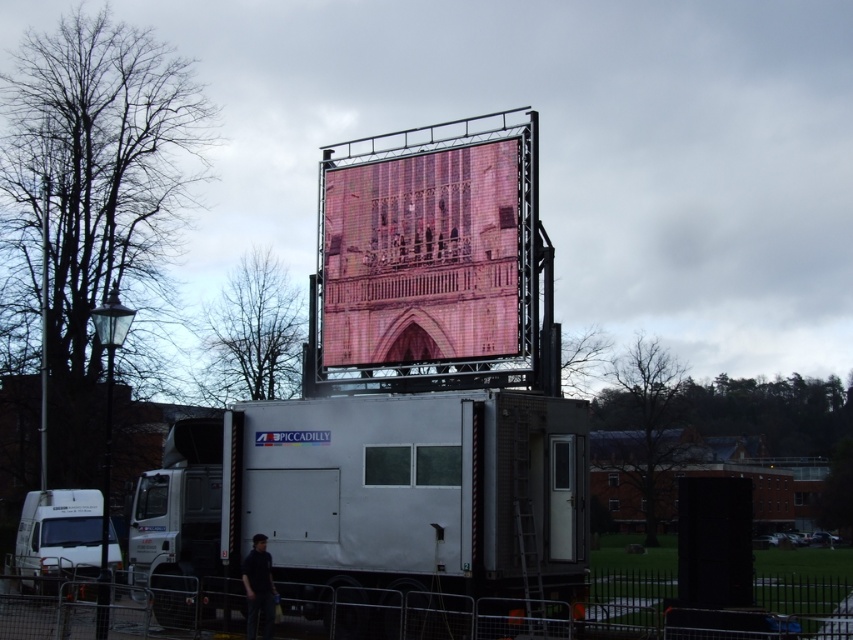
What do you see at coordinates (375, 497) in the screenshot? This screenshot has height=640, width=853. I see `white matte truck at center` at bounding box center [375, 497].

Who is shorter, white matte truck at center or white matte truck at lower left?

white matte truck at lower left is shorter.

Does point (395, 563) lie in front of point (78, 545)?

That is True.

Identify the location of white matte truck at center. (375, 497).

In the scene shown: Is pink pixelated screen at center above dark blue shirt at lower left?

Indeed, pink pixelated screen at center is positioned over dark blue shirt at lower left.

Can you confirm if pink pixelated screen at center is positioned to the right of dark blue shirt at lower left?

Indeed, pink pixelated screen at center is positioned on the right side of dark blue shirt at lower left.

Does point (416, 275) lie in front of point (252, 620)?

No, it is not.

Locate an element on the screen. Image resolution: width=853 pixels, height=640 pixels. pink pixelated screen at center is located at coordinates (422, 257).

Can you confirm if white matte truck at center is thinner than dark blue shirt at lower left?

No, white matte truck at center is not thinner than dark blue shirt at lower left.

Which is below, white matte truck at center or dark blue shirt at lower left?

Positioned lower is dark blue shirt at lower left.

Where is `white matte truck at center`? The height and width of the screenshot is (640, 853). white matte truck at center is located at coordinates (375, 497).

This screenshot has width=853, height=640. What are the coordinates of `white matte truck at center` in the screenshot? It's located at (375, 497).